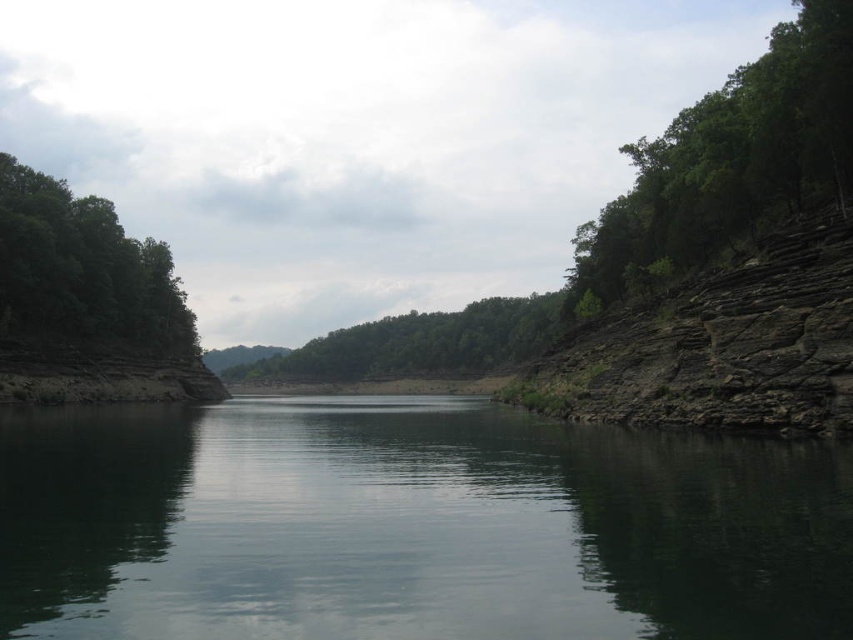
Question: Is dark green water at center below green leafy tree at left?

Choices:
 (A) no
 (B) yes

Answer: (B)

Question: Which object appears closest to the camera in this image?

Choices:
 (A) green leafy trees at center
 (B) green leafy tree at right
 (C) green leafy tree at left
 (D) dark green water at center

Answer: (D)

Question: Which of the following is the closest to the observer?

Choices:
 (A) (111, 264)
 (B) (296, 417)
 (C) (363, 324)
 (D) (798, 51)

Answer: (D)

Question: Which object is closer to the camera taking this photo?

Choices:
 (A) green leafy tree at right
 (B) dark green water at center

Answer: (B)

Question: Observing the image, what is the correct spatial positioning of green leafy tree at right in reference to green leafy trees at center?

Choices:
 (A) below
 (B) above

Answer: (B)

Question: Is green leafy tree at right below green leafy trees at center?

Choices:
 (A) no
 (B) yes

Answer: (A)